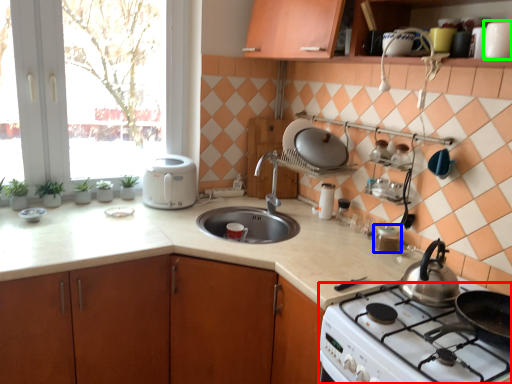
Question: Which object is positioned farthest from gas stove (highlighted by a red box)? Select from appliance (highlighted by a blue box) and appliance (highlighted by a green box).

Choices:
 (A) appliance
 (B) appliance

Answer: (B)